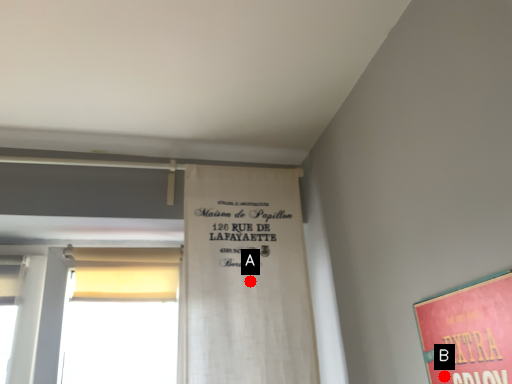
Question: Two points are circled on the image, labeled by A and B beside each circle. Which point is further to the camera?

Choices:
 (A) A is further
 (B) B is further

Answer: (A)